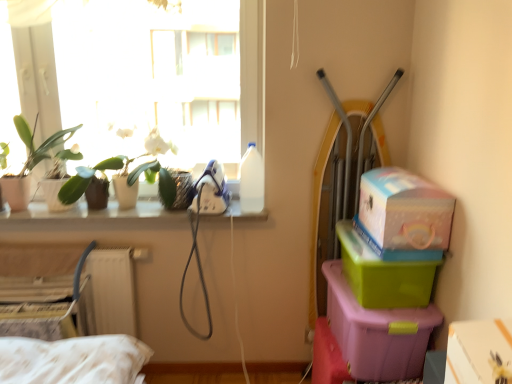
What do you see at coordinates (149, 86) in the screenshot? I see `transparent glass window at upper left` at bounding box center [149, 86].

The width and height of the screenshot is (512, 384). What do you see at coordinates (42, 320) in the screenshot?
I see `white cardboard box at lower left, acting as the first box starting from the left` at bounding box center [42, 320].

Measure the distance between point (x=28, y=314) and camera.

The distance of point (x=28, y=314) from camera is 6.11 feet.

Locate an element on the screen. The image size is (512, 384). white cardboard box at lower right, the 1th box in the right-to-left sequence is located at coordinates (479, 352).

Between green plastic box at lower right, arranged as the 4th box when viewed from the right, and transparent glass window at upper left, which one appears on the left side from the viewer's perspective?

From the viewer's perspective, transparent glass window at upper left appears more on the left side.

Is green plastic box at lower right, the 2th box from the left, inside or outside of transparent glass window at upper left?

green plastic box at lower right, the 2th box from the left, lies outside transparent glass window at upper left.

Considering the sizes of objects green plastic box at lower right, the 2th box from the left, and transparent glass window at upper left in the image provided, who is bigger, green plastic box at lower right, the 2th box from the left, or transparent glass window at upper left?

Bigger between the two is transparent glass window at upper left.

Between green plastic box at lower right, arranged as the 4th box when viewed from the right, and transparent glass window at upper left, which one has less height?

With less height is green plastic box at lower right, arranged as the 4th box when viewed from the right.

Considering the relative sizes of white textured bed at lower left and white cardboard box at lower right, the 1th box in the right-to-left sequence, in the image provided, is white textured bed at lower left wider than white cardboard box at lower right, the 1th box in the right-to-left sequence,?

No.

Between white textured bed at lower left and white cardboard box at lower right, the 1th box in the right-to-left sequence, which one has larger size?

white textured bed at lower left.

Is white textured bed at lower left to the right of white cardboard box at lower right, the 1th box in the right-to-left sequence, from the viewer's perspective?

In fact, white textured bed at lower left is to the left of white cardboard box at lower right, the 1th box in the right-to-left sequence.

Does white textured bed at lower left come behind pastel cardboard box at upper right, arranged as the 3th box when viewed from the right?

Yes, the depth of white textured bed at lower left is greater than that of pastel cardboard box at upper right, arranged as the 3th box when viewed from the right.

Does white textured bed at lower left have a greater height compared to pastel cardboard box at upper right, arranged as the 3th box when viewed from the right?

Yes.

Considering the sizes of white textured bed at lower left and pastel cardboard box at upper right, arranged as the 3th box when viewed from the right, in the image, is white textured bed at lower left bigger or smaller than pastel cardboard box at upper right, arranged as the 3th box when viewed from the right,?

Considering their sizes, white textured bed at lower left takes up more space than pastel cardboard box at upper right, arranged as the 3th box when viewed from the right.

Measure the distance between white textured bed at lower left and pastel cardboard box at upper right, marked as the 3th box in a left-to-right arrangement.

white textured bed at lower left is 4.30 feet from pastel cardboard box at upper right, marked as the 3th box in a left-to-right arrangement.

In the image, is transparent glass window at upper left positioned in front of or behind matte white pot at left?

transparent glass window at upper left is behind matte white pot at left.

You are a GUI agent. You are given a task and a screenshot of the screen. Output one action in this format:
    pyautogui.click(x=<x>, y=<y>)
    Task: Click on the window that appears above the matte white pot at left (from the image's perspective)
    
    Given the screenshot: What is the action you would take?
    pyautogui.click(x=149, y=86)

Considering the relative sizes of transparent glass window at upper left and matte white pot at left in the image provided, is transparent glass window at upper left taller than matte white pot at left?

Correct, transparent glass window at upper left is much taller as matte white pot at left.

In the image, is transparent glass window at upper left on the left side or the right side of matte white pot at left?

transparent glass window at upper left is positioned on matte white pot at left's right side.

Find the location of a particular element. window sill located below the green matte plant at upper left, positioned as the second plant in right-to-left order (from the image's perspective) is located at coordinates (93, 217).

Is green matte plant at upper left, acting as the first plant starting from the left, aimed at white glossy window sill at upper left?

No, green matte plant at upper left, acting as the first plant starting from the left, is not turned towards white glossy window sill at upper left.

Can you tell me how much green matte plant at upper left, acting as the first plant starting from the left, and white glossy window sill at upper left differ in facing direction?

green matte plant at upper left, acting as the first plant starting from the left, and white glossy window sill at upper left are facing 1.11 degrees away from each other.

Considering the relative sizes of green matte plant at upper left, positioned as the second plant in right-to-left order, and white glossy window sill at upper left in the image provided, is green matte plant at upper left, positioned as the second plant in right-to-left order, shorter than white glossy window sill at upper left?

No, green matte plant at upper left, positioned as the second plant in right-to-left order, is not shorter than white glossy window sill at upper left.

Are white matte orchid at upper left, the 1th plant from the right, and green matte plant at upper left, acting as the first plant starting from the left, located far from each other?

No, there isn't a large distance between white matte orchid at upper left, the 1th plant from the right, and green matte plant at upper left, acting as the first plant starting from the left.

Could you measure the distance between white matte orchid at upper left, the 1th plant from the right, and green matte plant at upper left, acting as the first plant starting from the left?

They are 2.62 inches apart.

Is white matte orchid at upper left, the 1th plant from the right, oriented towards green matte plant at upper left, positioned as the second plant in right-to-left order?

Yes, white matte orchid at upper left, the 1th plant from the right, is oriented towards green matte plant at upper left, positioned as the second plant in right-to-left order.

How different are the orientations of white matte orchid at upper left, which is the 2th plant in left-to-right order, and green matte plant at upper left, positioned as the second plant in right-to-left order, in degrees?

The facing directions of white matte orchid at upper left, which is the 2th plant in left-to-right order, and green matte plant at upper left, positioned as the second plant in right-to-left order, are 1.09 degrees apart.

From a real-world perspective, does white textured bed at lower left sit lower than green plastic box at right, the second box viewed from the right?

Correct, in the physical world, white textured bed at lower left is lower than green plastic box at right, the second box viewed from the right.

The image size is (512, 384). In the image, there is a green plastic box at right, placed as the 4th box when sorted from left to right. What are the coordinates of `bed below it (from the image's perspective)` in the screenshot? It's located at (71, 338).

Is point (41, 360) closer or farther from the camera than point (379, 297)?

Point (41, 360) appears to be closer to the viewer than point (379, 297).

In the scene shown: From the image's perspective, is white textured bed at lower left on top of green plastic box at right, placed as the 4th box when sorted from left to right?

Incorrect, from the image's perspective, white textured bed at lower left is lower than green plastic box at right, placed as the 4th box when sorted from left to right.

Find the location of a particular element. This screenshot has width=512, height=384. box that is the 4th object located below the transparent glass window at upper left (from the image's perspective) is located at coordinates (377, 332).

Where is `bed located underneath the white cardboard box at lower right, which ranks as the fifth box in left-to-right order (from a real-world perspective)`? The width and height of the screenshot is (512, 384). bed located underneath the white cardboard box at lower right, which ranks as the fifth box in left-to-right order (from a real-world perspective) is located at coordinates (71, 338).

Which object lies further to the anchor point pastel cardboard box at upper right, arranged as the 3th box when viewed from the right, green matte plant at upper left, acting as the first plant starting from the left, or transparent glass window at upper left?

green matte plant at upper left, acting as the first plant starting from the left, is further to pastel cardboard box at upper right, arranged as the 3th box when viewed from the right.

Based on their spatial positions, is white glossy window sill at upper left or matte white pot at left closer to white textured bed at lower left?

white glossy window sill at upper left.

From the image, which object appears to be nearer to white matte orchid at upper left, which is the 2th plant in left-to-right order, transparent glass window at upper left or green matte plant at upper left, positioned as the second plant in right-to-left order?

Among the two, green matte plant at upper left, positioned as the second plant in right-to-left order, is located nearer to white matte orchid at upper left, which is the 2th plant in left-to-right order.

Estimate the real-world distances between objects in this image. Which object is further from green plastic box at lower right, the 2th box from the left, white glossy window sill at upper left or transparent glass window at upper left?

transparent glass window at upper left is positioned further to the anchor green plastic box at lower right, the 2th box from the left.

When comparing their distances from green plastic box at right, the second box viewed from the right, does white glossy window sill at upper left or green matte plant at upper left, acting as the first plant starting from the left, seem further?

Based on the image, green matte plant at upper left, acting as the first plant starting from the left, appears to be further to green plastic box at right, the second box viewed from the right.

Which object lies further to the anchor point matte white pot at left, white cardboard box at lower right, which ranks as the fifth box in left-to-right order, or white matte orchid at upper left, which is the 2th plant in left-to-right order?

Result: white cardboard box at lower right, which ranks as the fifth box in left-to-right order, lies further to matte white pot at left than the other object.

When comparing their distances from green plastic box at right, placed as the 4th box when sorted from left to right, does white textured bed at lower left or green matte plant at upper left, acting as the first plant starting from the left, seem further?

Among the two, green matte plant at upper left, acting as the first plant starting from the left, is located further to green plastic box at right, placed as the 4th box when sorted from left to right.

Which object lies nearer to the anchor point green plastic box at right, placed as the 4th box when sorted from left to right, pastel cardboard box at upper right, arranged as the 3th box when viewed from the right, or white matte orchid at upper left, the 1th plant from the right?

pastel cardboard box at upper right, arranged as the 3th box when viewed from the right.

Where is `window sill between white cardboard box at lower left, acting as the first box starting from the left, and green plastic box at lower right, arranged as the 4th box when viewed from the right, from left to right`? The image size is (512, 384). window sill between white cardboard box at lower left, acting as the first box starting from the left, and green plastic box at lower right, arranged as the 4th box when viewed from the right, from left to right is located at coordinates (93, 217).

In order to click on bed located between matte white pot at left and white cardboard box at lower right, which ranks as the fifth box in left-to-right order, in the left-right direction in this screenshot , I will do `click(71, 338)`.

Where is `window sill located between white cardboard box at lower left, acting as the first box starting from the left, and pastel cardboard box at upper right, marked as the 3th box in a left-to-right arrangement, in the left-right direction`? The height and width of the screenshot is (384, 512). window sill located between white cardboard box at lower left, acting as the first box starting from the left, and pastel cardboard box at upper right, marked as the 3th box in a left-to-right arrangement, in the left-right direction is located at coordinates (93, 217).

I want to click on bed located between white cardboard box at lower left, the 5th box in the right-to-left sequence, and white cardboard box at lower right, the 1th box in the right-to-left sequence, in the left-right direction, so click(x=71, y=338).